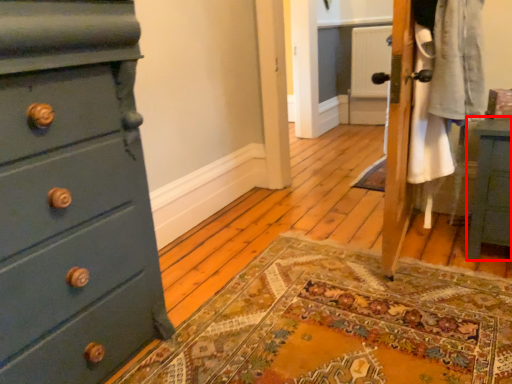
Question: From the image's perspective, what is the correct spatial relationship of nightstand (annotated by the red box) in relation to chest of drawers?

Choices:
 (A) below
 (B) above

Answer: (B)